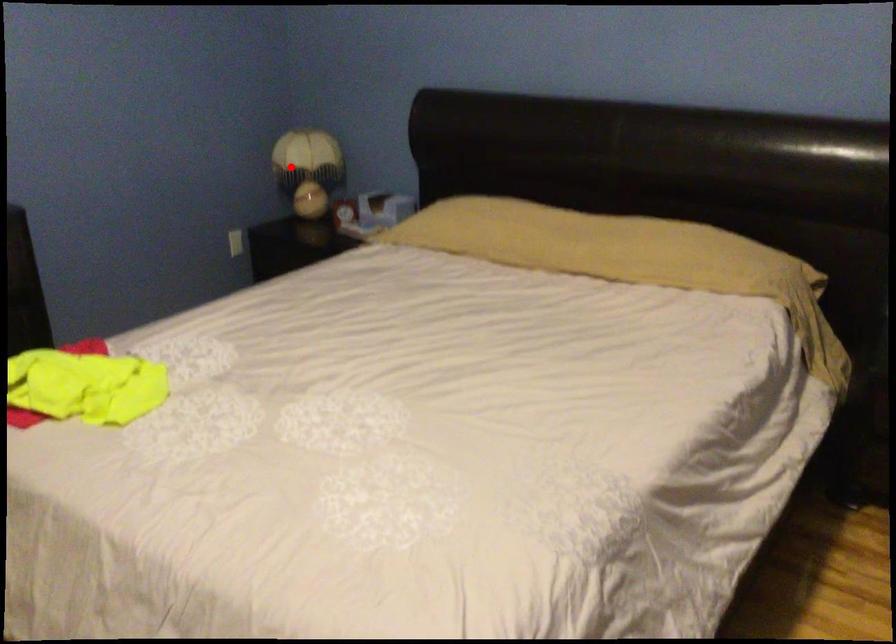
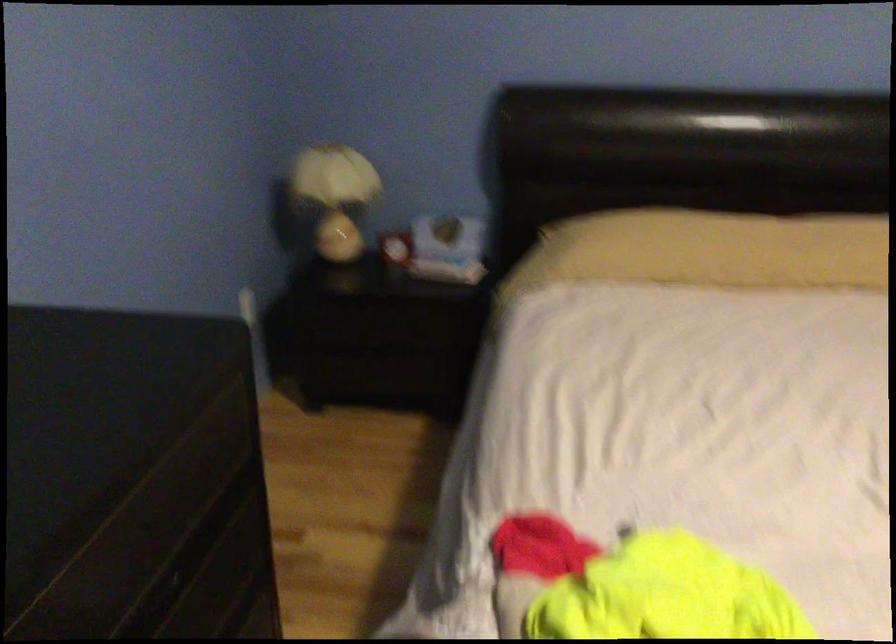
In the second image, find the point that corresponds to the highlighted location in the first image.

(332, 196)